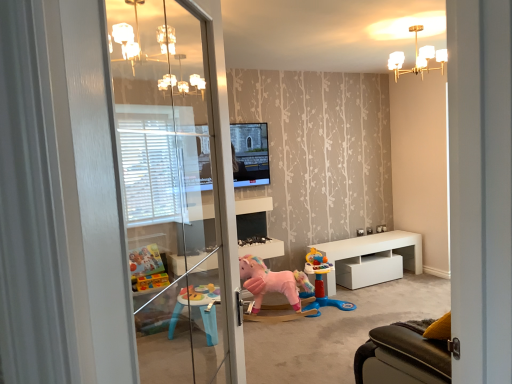
In order to face white glossy table at lower right, should I rotate leftwards or rightwards?

Rotate your view right by about 14.516°.

Image resolution: width=512 pixels, height=384 pixels. Describe the element at coordinates (371, 259) in the screenshot. I see `white glossy table at lower right` at that location.

This screenshot has height=384, width=512. What do you see at coordinates (322, 282) in the screenshot?
I see `pink plush unicorn at center, which is the first toy from right to left` at bounding box center [322, 282].

From the picture: What is the approximate width of gold metallic chandelier at upper center?

The width of gold metallic chandelier at upper center is 42.74 centimeters.

The height and width of the screenshot is (384, 512). What do you see at coordinates (272, 284) in the screenshot?
I see `pink plush rocking horse at center, positioned as the second toy in right-to-left order` at bounding box center [272, 284].

Measure the distance between transparent glass screen door at left and camera.

The distance of transparent glass screen door at left from camera is 2.09 meters.

Identify the location of white glossy table at lower right. The width and height of the screenshot is (512, 384). (371, 259).

Is white glossy table at lower right wider or thinner than pink plush rocking horse at center, arranged as the 1th toy when viewed from the left?

Clearly, white glossy table at lower right has more width compared to pink plush rocking horse at center, arranged as the 1th toy when viewed from the left.

Which is more to the left, white glossy table at lower right or pink plush rocking horse at center, positioned as the second toy in right-to-left order?

Positioned to the left is pink plush rocking horse at center, positioned as the second toy in right-to-left order.

From a real-world perspective, is white glossy table at lower right on top of pink plush rocking horse at center, positioned as the second toy in right-to-left order?

Incorrect, from a real-world perspective, white glossy table at lower right is lower than pink plush rocking horse at center, positioned as the second toy in right-to-left order.

Is white glossy table at lower right behind pink plush rocking horse at center, positioned as the second toy in right-to-left order?

Yes.

Is pink plush unicorn at center, the 2th toy viewed from the left, turned away from gold metallic chandelier at upper center?

No, gold metallic chandelier at upper center is not at the back of pink plush unicorn at center, the 2th toy viewed from the left.

From the image's perspective, which is below, pink plush unicorn at center, the 2th toy viewed from the left, or gold metallic chandelier at upper center?

pink plush unicorn at center, the 2th toy viewed from the left.

Consider the image. From a real-world perspective, between pink plush unicorn at center, the 2th toy viewed from the left, and gold metallic chandelier at upper center, who is vertically higher?

gold metallic chandelier at upper center.

Is the position of pink plush unicorn at center, the 2th toy viewed from the left, less distant than that of gold metallic chandelier at upper center?

No, pink plush unicorn at center, the 2th toy viewed from the left, is behind gold metallic chandelier at upper center.

Based on their sizes in the image, would you say pink plush unicorn at center, which is the first toy from right to left, is bigger or smaller than transparent glass screen door at left?

Clearly, pink plush unicorn at center, which is the first toy from right to left, is larger in size than transparent glass screen door at left.

From the image's perspective, relative to transparent glass screen door at left, is pink plush unicorn at center, the 2th toy viewed from the left, above or below?

From the image's perspective, pink plush unicorn at center, the 2th toy viewed from the left, appears below transparent glass screen door at left.

Can you confirm if pink plush unicorn at center, which is the first toy from right to left, is positioned to the right of transparent glass screen door at left?

Indeed, pink plush unicorn at center, which is the first toy from right to left, is positioned on the right side of transparent glass screen door at left.

Based on the photo, considering their positions, is pink plush unicorn at center, which is the first toy from right to left, located in front of or behind transparent glass screen door at left?

pink plush unicorn at center, which is the first toy from right to left, is behind transparent glass screen door at left.

Is matte black television at center located within gold metallic chandelier at upper center?

No, matte black television at center is located outside of gold metallic chandelier at upper center.

Consider the image. From the image's perspective, between gold metallic chandelier at upper center and matte black television at center, which one is located above?

From the image's view, gold metallic chandelier at upper center is above.

Considering the positions of point (426, 62) and point (247, 134), is point (426, 62) closer or farther from the camera than point (247, 134)?

Point (426, 62) appears to be farther away from the viewer than point (247, 134).

Considering the sizes of gold metallic chandelier at upper center and matte black television at center in the image, is gold metallic chandelier at upper center bigger or smaller than matte black television at center?

Considering their sizes, gold metallic chandelier at upper center takes up more space than matte black television at center.

Is pink plush rocking horse at center, positioned as the second toy in right-to-left order, wider or thinner than white glossy table at lower right?

Considering their sizes, pink plush rocking horse at center, positioned as the second toy in right-to-left order, looks slimmer than white glossy table at lower right.

Is point (287, 283) closer to viewer compared to point (332, 293)?

Yes.

Can you tell me how much pink plush rocking horse at center, arranged as the 1th toy when viewed from the left, and white glossy table at lower right differ in facing direction?

There is a 29.8-degree angle between the facing directions of pink plush rocking horse at center, arranged as the 1th toy when viewed from the left, and white glossy table at lower right.

From a real-world perspective, is pink plush rocking horse at center, positioned as the second toy in right-to-left order, above or below white glossy table at lower right?

From a real-world perspective, pink plush rocking horse at center, positioned as the second toy in right-to-left order, is physically above white glossy table at lower right.

Where is `screen door in front of the pink plush rocking horse at center, positioned as the second toy in right-to-left order`? The height and width of the screenshot is (384, 512). screen door in front of the pink plush rocking horse at center, positioned as the second toy in right-to-left order is located at coordinates (148, 190).

From the picture: Which is behind, transparent glass screen door at left or pink plush rocking horse at center, positioned as the second toy in right-to-left order?

pink plush rocking horse at center, positioned as the second toy in right-to-left order, is further from the camera.

From the picture: Considering the relative sizes of transparent glass screen door at left and pink plush rocking horse at center, arranged as the 1th toy when viewed from the left, in the image provided, is transparent glass screen door at left smaller than pink plush rocking horse at center, arranged as the 1th toy when viewed from the left,?

Indeed, transparent glass screen door at left has a smaller size compared to pink plush rocking horse at center, arranged as the 1th toy when viewed from the left.

In the scene shown: Considering the relative sizes of transparent glass screen door at left and pink plush rocking horse at center, arranged as the 1th toy when viewed from the left, in the image provided, is transparent glass screen door at left wider than pink plush rocking horse at center, arranged as the 1th toy when viewed from the left,?

In fact, transparent glass screen door at left might be narrower than pink plush rocking horse at center, arranged as the 1th toy when viewed from the left.

Between matte black television at center and pink plush unicorn at center, which is the first toy from right to left, which one has less height?

Standing shorter between the two is pink plush unicorn at center, which is the first toy from right to left.

Is matte black television at center facing away from pink plush unicorn at center, which is the first toy from right to left?

No, pink plush unicorn at center, which is the first toy from right to left, is not at the back of matte black television at center.

Visually, is matte black television at center positioned to the left or to the right of pink plush unicorn at center, which is the first toy from right to left?

Clearly, matte black television at center is on the left of pink plush unicorn at center, which is the first toy from right to left, in the image.

I want to click on table above the pink plush rocking horse at center, arranged as the 1th toy when viewed from the left (from the image's perspective), so click(x=371, y=259).

In order to click on the 1st toy to the left of the gold metallic chandelier at upper center, starting your count from the anchor in this screenshot , I will do `click(322, 282)`.

Estimate the real-world distances between objects in this image. Which object is closer to white glossy table at lower right, transparent glass screen door at left or pink plush rocking horse at center, arranged as the 1th toy when viewed from the left?

Based on the image, pink plush rocking horse at center, arranged as the 1th toy when viewed from the left, appears to be nearer to white glossy table at lower right.

Estimate the real-world distances between objects in this image. Which object is closer to white glossy table at lower right, pink plush rocking horse at center, positioned as the second toy in right-to-left order, or pink plush unicorn at center, the 2th toy viewed from the left?

pink plush unicorn at center, the 2th toy viewed from the left, is closer to white glossy table at lower right.

From the image, which object appears to be farther from gold metallic chandelier at upper center, matte black television at center or white glossy table at lower right?

Among the two, white glossy table at lower right is located further to gold metallic chandelier at upper center.

Estimate the real-world distances between objects in this image. Which object is closer to gold metallic chandelier at upper center, transparent glass screen door at left or pink plush rocking horse at center, positioned as the second toy in right-to-left order?

The object closer to gold metallic chandelier at upper center is pink plush rocking horse at center, positioned as the second toy in right-to-left order.

Estimate the real-world distances between objects in this image. Which object is closer to matte black television at center, white glossy table at lower right or pink plush unicorn at center, the 2th toy viewed from the left?

pink plush unicorn at center, the 2th toy viewed from the left, is closer to matte black television at center.

Looking at the image, which one is located closer to gold metallic chandelier at upper center, white glossy table at lower right or transparent glass screen door at left?

white glossy table at lower right.

Considering their positions, is pink plush unicorn at center, which is the first toy from right to left, positioned further to transparent glass screen door at left than white glossy table at lower right?

Based on the image, white glossy table at lower right appears to be further to transparent glass screen door at left.

Based on their spatial positions, is matte black television at center or transparent glass screen door at left further from white glossy table at lower right?

transparent glass screen door at left.

Find the location of a particular element. light fixture between transparent glass screen door at left and matte black television at center in the front-back direction is located at coordinates (417, 57).

Where is `window screen between transparent glass screen door at left and white glossy table at lower right from front to back`? window screen between transparent glass screen door at left and white glossy table at lower right from front to back is located at coordinates (250, 154).

This screenshot has width=512, height=384. I want to click on light fixture positioned between transparent glass screen door at left and pink plush rocking horse at center, positioned as the second toy in right-to-left order, from near to far, so click(417, 57).

Where is `table between gold metallic chandelier at upper center and pink plush rocking horse at center, arranged as the 1th toy when viewed from the left, vertically`? table between gold metallic chandelier at upper center and pink plush rocking horse at center, arranged as the 1th toy when viewed from the left, vertically is located at coordinates (371, 259).